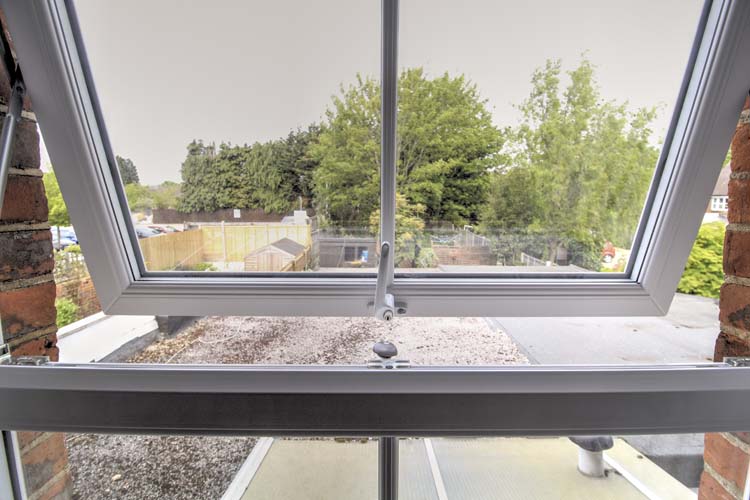
You are a GUI agent. You are given a task and a screenshot of the screen. Output one action in this format:
    pyautogui.click(x=<x>, y=<y>)
    Task: Click on the window
    
    Given the screenshot: What is the action you would take?
    pyautogui.click(x=688, y=226), pyautogui.click(x=556, y=401)